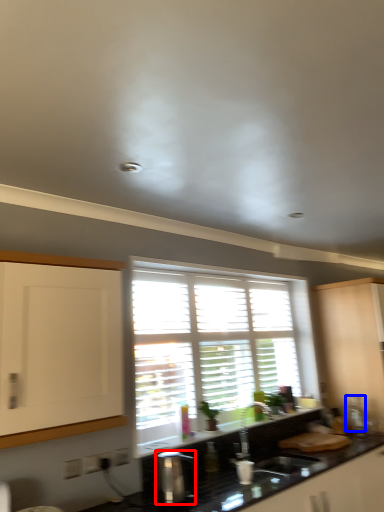
Question: Which object appears closest to the camera in this image, appliance (highlighted by a red box) or appliance (highlighted by a blue box)?

Choices:
 (A) appliance
 (B) appliance

Answer: (A)